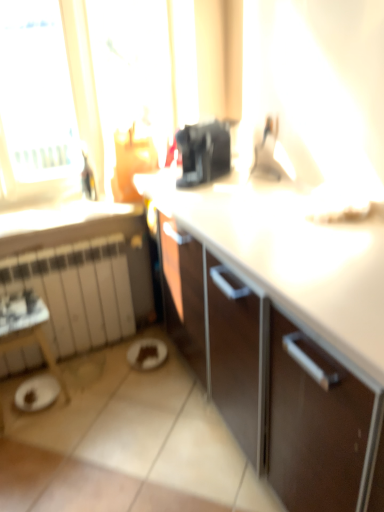
The width and height of the screenshot is (384, 512). I want to click on free space below white matte radiator at lower left (from a real-world perspective), so click(91, 349).